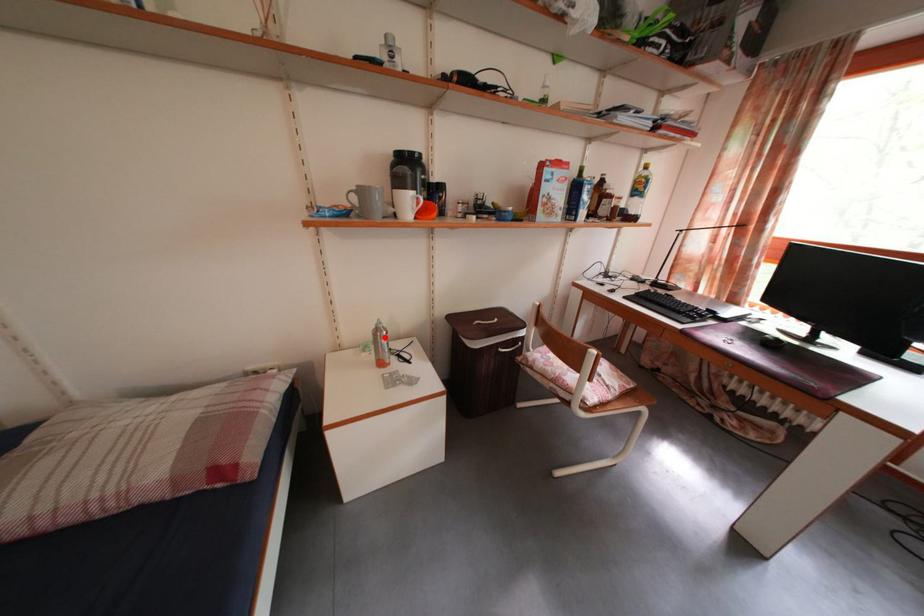
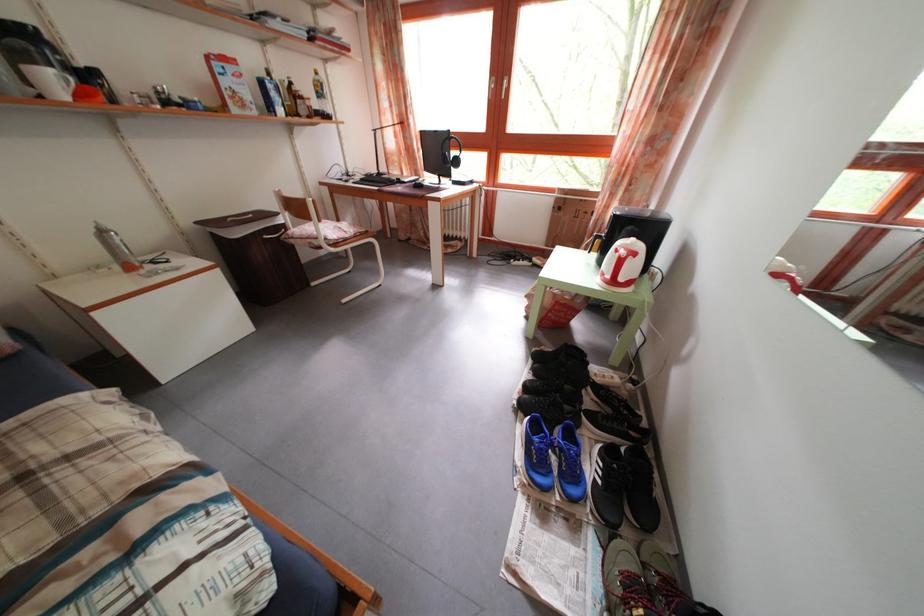
Question: A red point is marked in image1. In image2, is the corresponding 3D point closer to the camera or farther? Reply with the corresponding letter.

Choices:
 (A) The corresponding 3D point is closer.
 (B) The corresponding 3D point is farther.

Answer: (B)